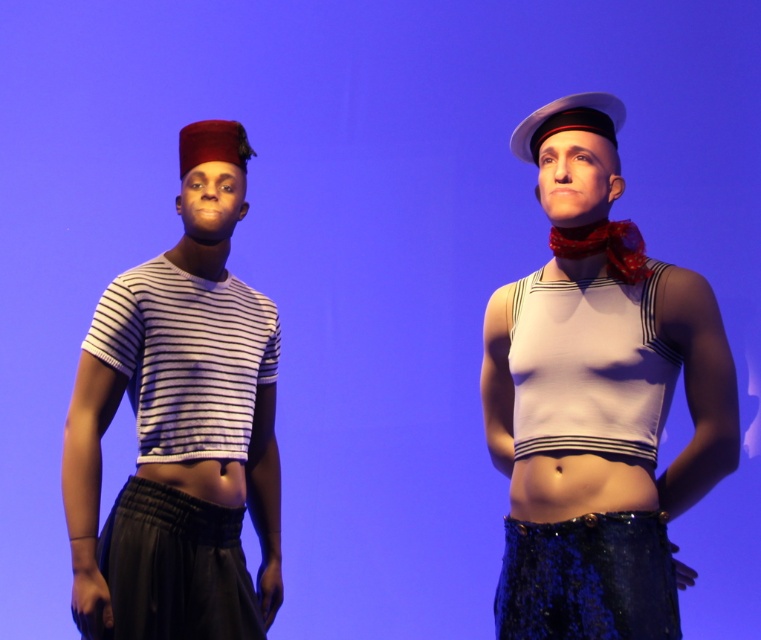
You are an art curator planning to place a new sculpture between the two points, point (212, 180) and point (100, 356). Which point should the sculpture be closer to in order to maintain depth perspective?

The sculpture should be closer to point (100, 356) because point (212, 180) is further to the viewer, so placing it closer to the farther point maintains depth perspective.

You are designing a stage set where both the white matte sailor top at center and the white striped fabric shirt at left need to fit through a narrow costume rack. Based on the image, which garment is wider?

The white matte sailor top at center is wider than the white striped fabric shirt at left according to the description, so it would require more space on the costume rack.

You are a photographer trying to capture a closeup shot of the white matte sailor top at center. You have a camera that requires a minimum distance of 1.5 meters to focus properly. Can you take the photo without moving closer than the current position?

The white matte sailor top at center and camera are 2.03 meters apart from each other. Since 2.03 meters is greater than the minimum required 1.5 meters, you can take the photo without moving closer.